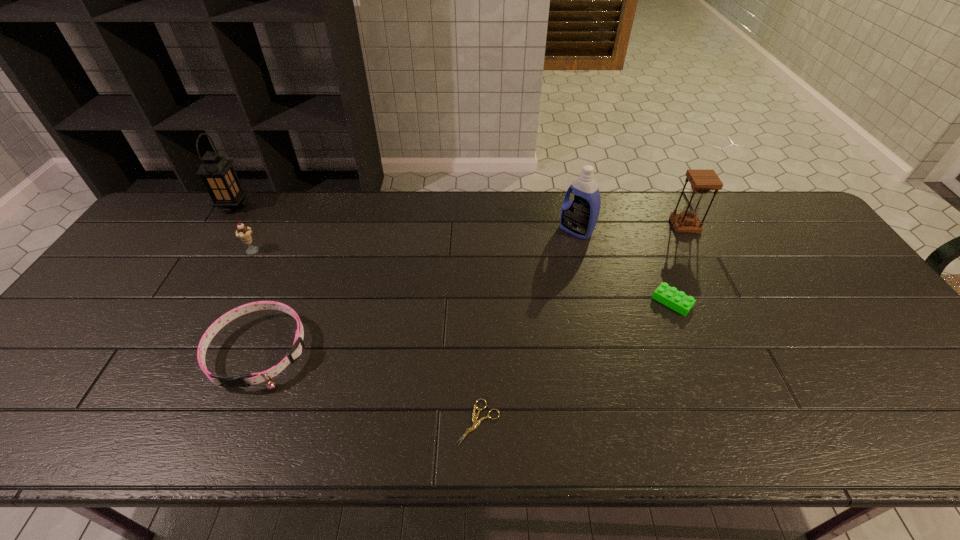
Locate an element on the screen. The image size is (960, 540). lantern is located at coordinates (218, 175).

Identify the location of the farthest object. (218, 175).

This screenshot has width=960, height=540. Find the location of `detergent`. detergent is located at coordinates (578, 217).

Identify the location of hourglass. This screenshot has width=960, height=540. (702, 181).

This screenshot has height=540, width=960. What are the coordinates of `the fifth shortest object` in the screenshot? It's located at (702, 181).

Locate an element on the screen. the fourth nearest object is located at coordinates (x=243, y=232).

I want to click on icecream, so click(243, 232).

Where is `dog collar`? This screenshot has width=960, height=540. dog collar is located at coordinates 296,351.

In order to click on Lego in this screenshot , I will do `click(677, 300)`.

This screenshot has width=960, height=540. Find the location of `the second shortest object`. the second shortest object is located at coordinates (677, 300).